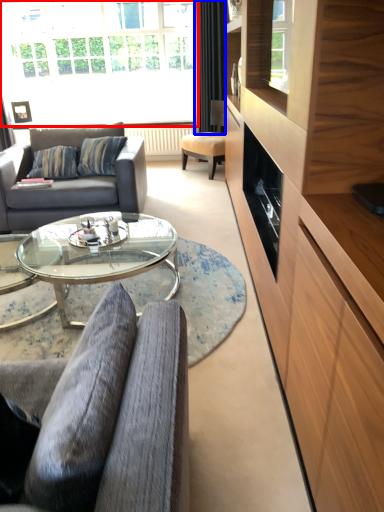
Question: Which object is closer to the camera taking this photo, window (highlighted by a red box) or curtain (highlighted by a blue box)?

Choices:
 (A) window
 (B) curtain

Answer: (B)